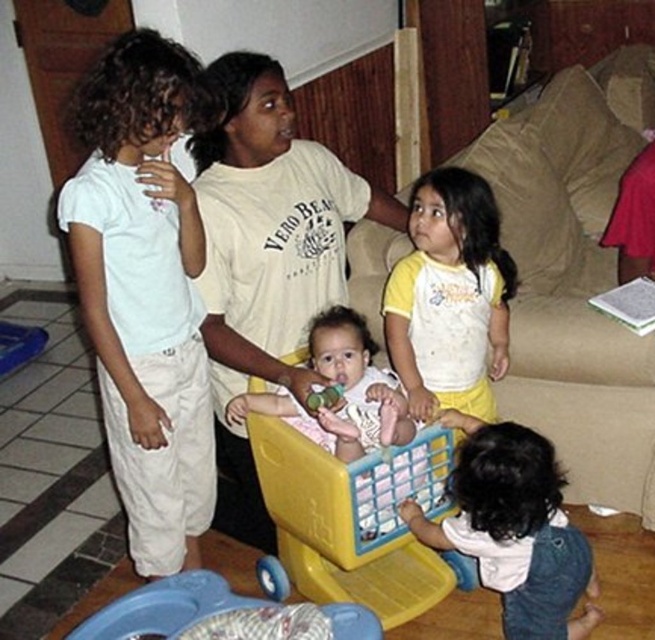
How much distance is there between yellow plastic shopping cart at center and white cotton shirt at lower right?

A distance of 10.46 inches exists between yellow plastic shopping cart at center and white cotton shirt at lower right.

Does point (403, 490) come closer to viewer compared to point (533, 534)?

No.

Does point (312, 502) come in front of point (481, 492)?

No.

This screenshot has height=640, width=655. Find the location of `yellow plastic shopping cart at center`. yellow plastic shopping cart at center is located at coordinates (356, 516).

Is white cotton pants at left below yellow plastic shopping cart at center?

No.

Does white cotton pants at left appear over yellow plastic shopping cart at center?

Correct, white cotton pants at left is located above yellow plastic shopping cart at center.

Is point (159, 145) farther from viewer compared to point (297, 540)?

No, (159, 145) is in front of (297, 540).

Identify the location of white cotton pants at left. (143, 294).

Is the position of yellow plastic shopping cart at center more distant than that of yellow cotton shirt at center?

No, yellow plastic shopping cart at center is in front of yellow cotton shirt at center.

Find the location of `yellow plastic shopping cart at center`. yellow plastic shopping cart at center is located at coordinates (356, 516).